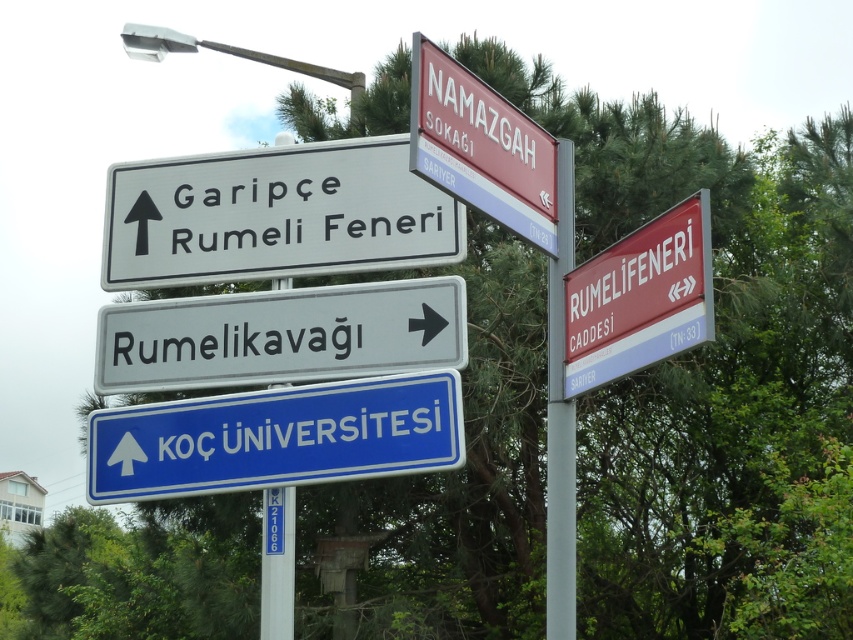
You are standing at the intersection and need to reach the blue metallic sign at center. Which direction should you move relative to the metallic signpost at right?

The blue metallic sign at center is positioned under the metallic signpost at right, so you should move downward from the metallic signpost at right to reach it.

You are standing at the intersection and see the blue metallic sign at center and the metallic signpost at right. Which one is positioned more to the left?

The blue metallic sign at center is positioned to the left of the metallic signpost at right, so it is more to the left.